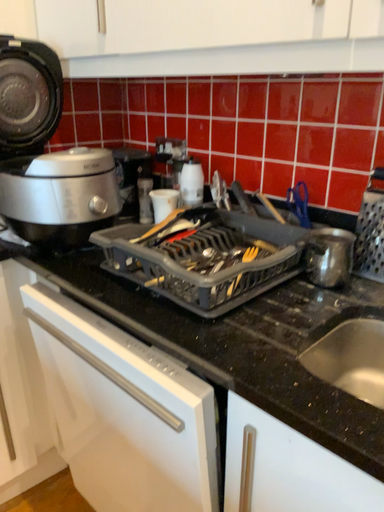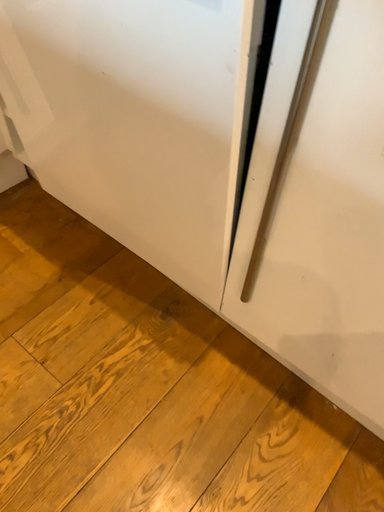
Question: Which way did the camera rotate in the video?

Choices:
 (A) rotated left
 (B) rotated right

Answer: (B)